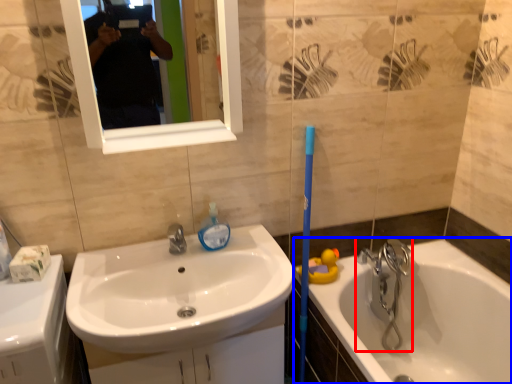
Question: Which point is further to the camera, tap (highlighted by a red box) or bathtub (highlighted by a blue box)?

Choices:
 (A) tap
 (B) bathtub

Answer: (A)